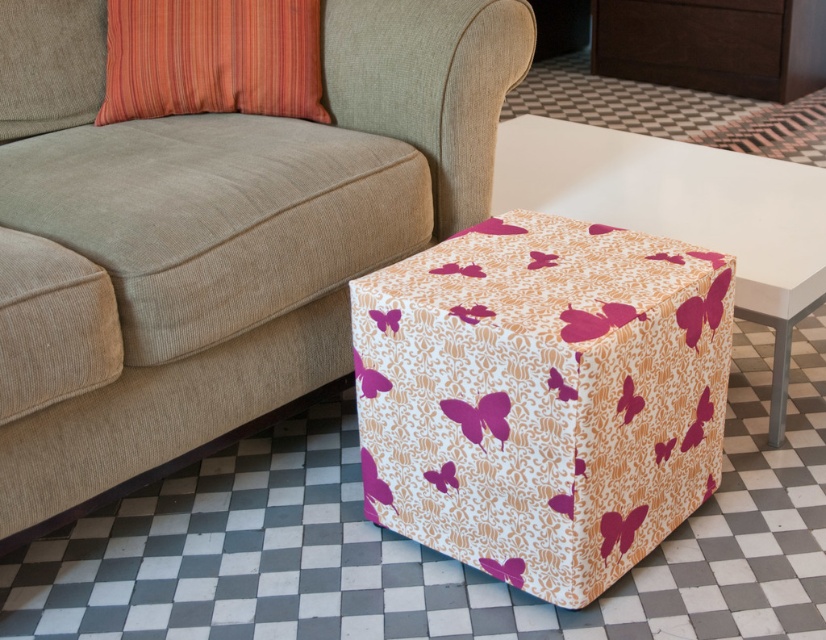
Between beige fabric couch at lower left and matte pink fabric cube at center, which one appears on the left side from the viewer's perspective?

beige fabric couch at lower left

Who is taller, beige fabric couch at lower left or matte pink fabric cube at center?

With more height is beige fabric couch at lower left.

Measure the distance between point (181, 218) and camera.

Point (181, 218) and camera are 4.43 feet apart.

Image resolution: width=826 pixels, height=640 pixels. I want to click on beige fabric couch at lower left, so click(216, 232).

Can you confirm if beige fabric couch at lower left is positioned to the right of white fabric with pink butterflies at lower right?

In fact, beige fabric couch at lower left is to the left of white fabric with pink butterflies at lower right.

Is the position of beige fabric couch at lower left more distant than that of white fabric with pink butterflies at lower right?

No, it is not.

Which is in front, point (81, 52) or point (355, 328)?

Point (355, 328) is more forward.

The image size is (826, 640). I want to click on beige fabric couch at lower left, so click(x=216, y=232).

The height and width of the screenshot is (640, 826). What do you see at coordinates (542, 396) in the screenshot?
I see `white fabric with pink butterflies at lower right` at bounding box center [542, 396].

Is white fabric with pink butterflies at lower right above orange striped pillow at upper left?

No, white fabric with pink butterflies at lower right is not above orange striped pillow at upper left.

Between point (596, 561) and point (224, 96), which one is positioned behind?

The point (224, 96) is more distant.

This screenshot has height=640, width=826. In order to click on white fabric with pink butterflies at lower right in this screenshot , I will do `click(542, 396)`.